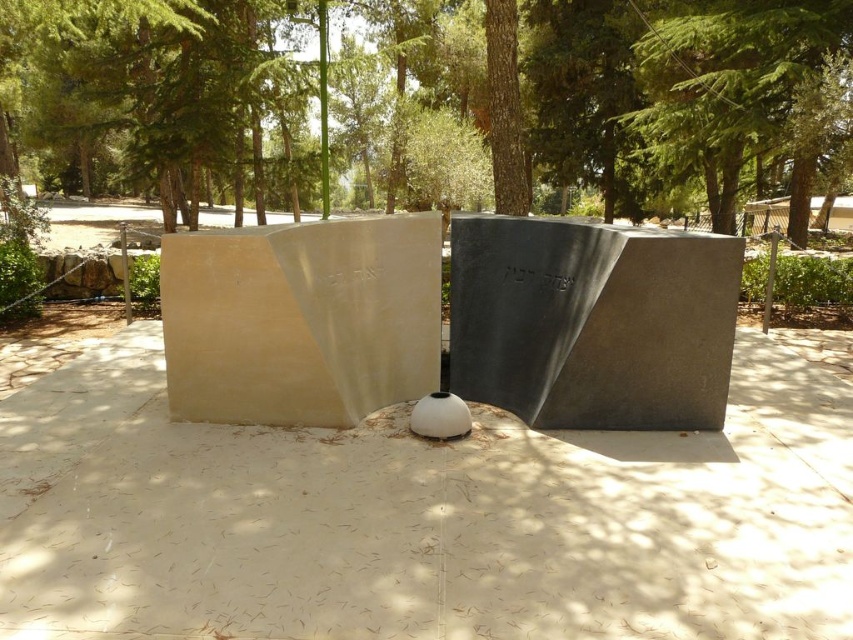
Based on the photo, can you confirm if green leafy tree at center is positioned above black polished stone at center?

Correct, green leafy tree at center is located above black polished stone at center.

Which is below, green leafy tree at center or black polished stone at center?

black polished stone at center

Is point (833, 65) positioned behind point (689, 362)?

Yes.

The height and width of the screenshot is (640, 853). What are the coordinates of `green leafy tree at center` in the screenshot? It's located at (433, 93).

Is point (286, 577) positioned behind point (734, 316)?

That is False.

Can you confirm if beige concrete at center is positioned to the left of black polished stone at center?

Indeed, beige concrete at center is positioned on the left side of black polished stone at center.

Find the location of a particular element. Image resolution: width=853 pixels, height=640 pixels. beige concrete at center is located at coordinates (422, 516).

Is beige concrete at center to the left of green leafy tree at center from the viewer's perspective?

No, beige concrete at center is not to the left of green leafy tree at center.

Who is positioned more to the left, beige concrete at center or green leafy tree at center?

Positioned to the left is green leafy tree at center.

Find the location of a particular element. The height and width of the screenshot is (640, 853). beige concrete at center is located at coordinates (422, 516).

I want to click on beige concrete at center, so click(x=422, y=516).